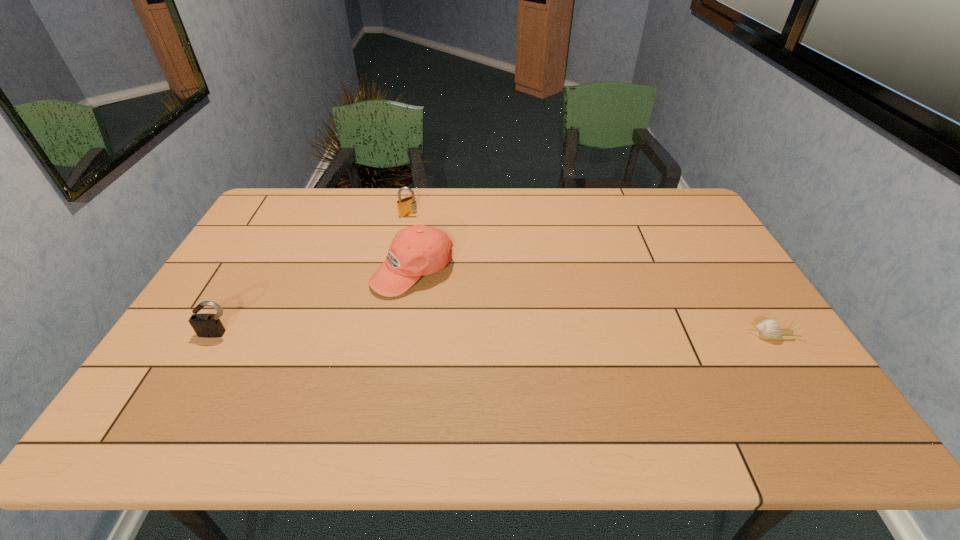
Locate an element on the screen. the leftmost object is located at coordinates (205, 325).

This screenshot has width=960, height=540. In order to click on the left padlock in this screenshot , I will do `click(205, 325)`.

Identify the location of escargot. (767, 329).

At what (x,y) coordinates should I click in order to perform the action: click on the shortest object. Please return your answer as a coordinate pair (x, y). The height and width of the screenshot is (540, 960). Looking at the image, I should click on (767, 329).

Identify the location of the right padlock. (407, 206).

Find the location of a particular element. The height and width of the screenshot is (540, 960). the farthest object is located at coordinates (407, 206).

Locate an element on the screen. This screenshot has width=960, height=540. baseball cap is located at coordinates (418, 250).

At what (x,y) coordinates should I click in order to perform the action: click on the tallest object. Please return your answer as a coordinate pair (x, y). The width and height of the screenshot is (960, 540). Looking at the image, I should click on (418, 250).

Where is `free spot located 0.070m with the keyhole on the front of the leftmost object`? The width and height of the screenshot is (960, 540). free spot located 0.070m with the keyhole on the front of the leftmost object is located at coordinates (203, 360).

The width and height of the screenshot is (960, 540). In order to click on vacant space located 0.210m on the shell of the escargot in this screenshot , I will do `click(669, 335)`.